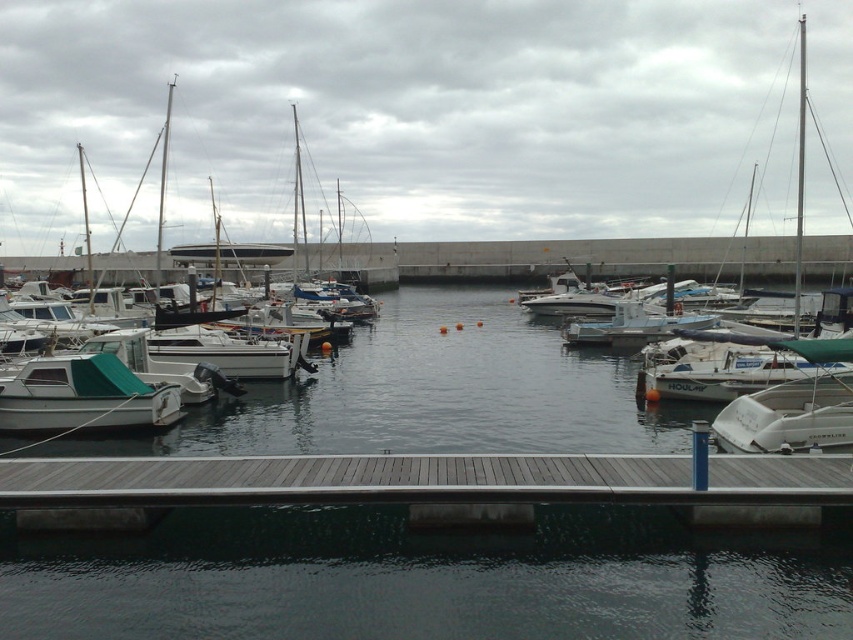
Is white matte sailboat at left to the right of white matte boat at left from the viewer's perspective?

In fact, white matte sailboat at left is to the left of white matte boat at left.

Between point (299, 204) and point (144, 413), which one is positioned behind?

Point (299, 204)

You are a GUI agent. You are given a task and a screenshot of the screen. Output one action in this format:
    pyautogui.click(x=<x>, y=<y>)
    Task: Click on the white matte sailboat at left
    This screenshot has width=853, height=640.
    Given the screenshot: What is the action you would take?
    pyautogui.click(x=221, y=320)

Consider the image. Who is lower down, clear water at center or white matte sailboat at left?

clear water at center is below.

Where is `clear water at center`? The height and width of the screenshot is (640, 853). clear water at center is located at coordinates (425, 579).

In order to click on clear water at center in this screenshot , I will do `click(425, 579)`.

Does point (263, 484) come farther from viewer compared to point (265, 342)?

That is False.

Does point (265, 486) come closer to viewer compared to point (163, 321)?

Yes, point (265, 486) is closer to viewer.

Does point (270, 456) lie in front of point (180, 260)?

Yes.

You are a GUI agent. You are given a task and a screenshot of the screen. Output one action in this format:
    pyautogui.click(x=<x>, y=<y>)
    Task: Click on the wooden dock at center
    Image resolution: width=853 pixels, height=640 pixels.
    Given the screenshot: What is the action you would take?
    pyautogui.click(x=422, y=477)